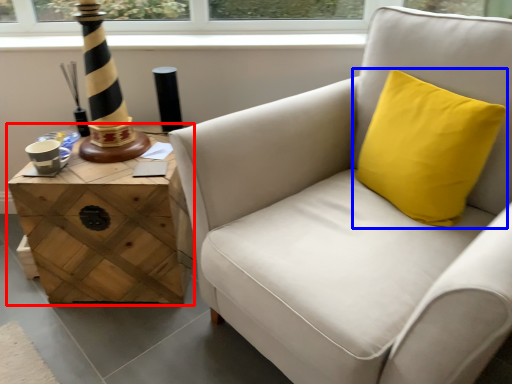
Question: Which object appears closest to the camera in this image, table (highlighted by a red box) or pillow (highlighted by a blue box)?

Choices:
 (A) table
 (B) pillow

Answer: (B)